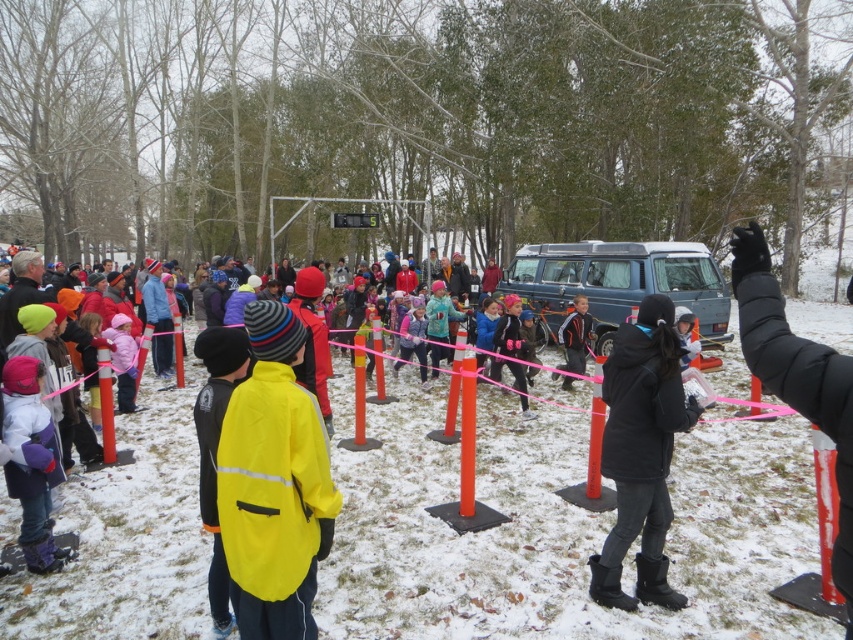
Question: Considering the relative positions of blue metallic van at center and dark blue jacket at center in the image provided, where is blue metallic van at center located with respect to dark blue jacket at center?

Choices:
 (A) left
 (B) right

Answer: (B)

Question: Among these points, which one is nearest to the camera?

Choices:
 (A) (569, 362)
 (B) (548, 317)
 (C) (654, 461)
 (D) (51, 563)

Answer: (C)

Question: Which point is closer to the camera taking this photo?

Choices:
 (A) (24, 460)
 (B) (577, 300)

Answer: (A)

Question: Can you confirm if black matte jacket at lower right is positioned to the left of purple fleece jacket at lower left?

Choices:
 (A) no
 (B) yes

Answer: (A)

Question: Among these points, which one is farthest from the camera?

Choices:
 (A) (663, 493)
 (B) (581, 310)

Answer: (B)

Question: Considering the relative positions of purple fleece jacket at lower left and dark blue jacket at center in the image provided, where is purple fleece jacket at lower left located with respect to dark blue jacket at center?

Choices:
 (A) right
 (B) left

Answer: (B)